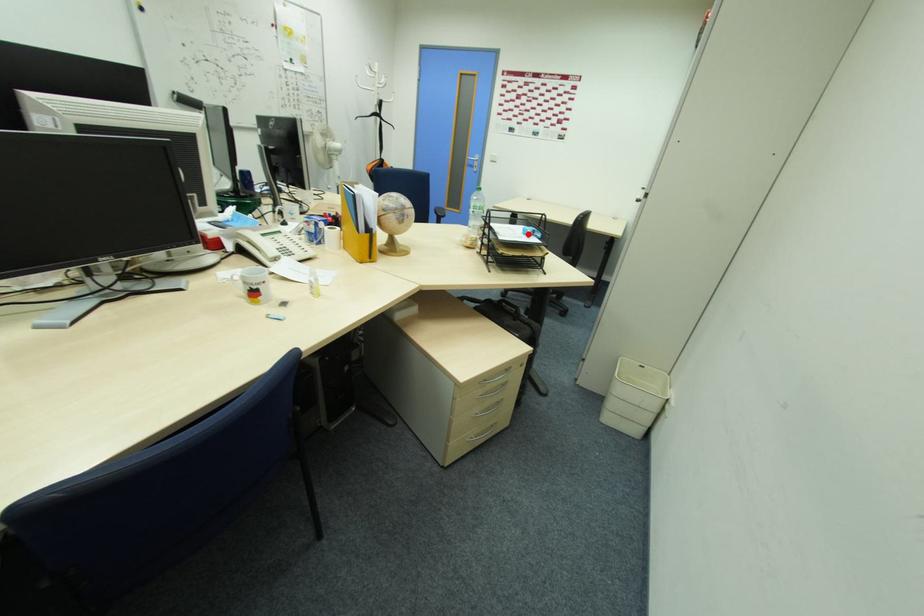
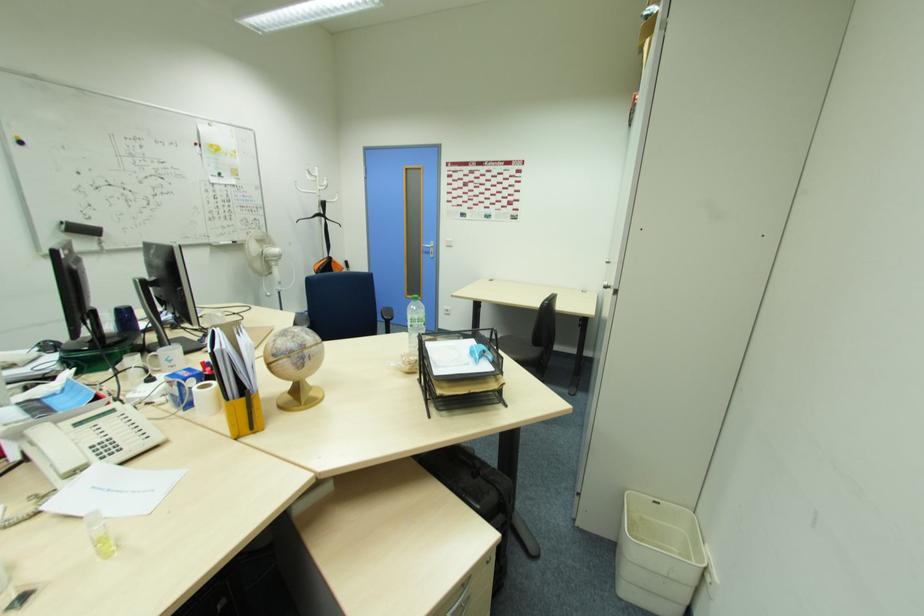
Question: A red point is marked in image1. In image2, is the corresponding 3D point closer to the camera or farther? Reply with the corresponding letter.

Choices:
 (A) The corresponding 3D point is closer.
 (B) The corresponding 3D point is farther.

Answer: (B)